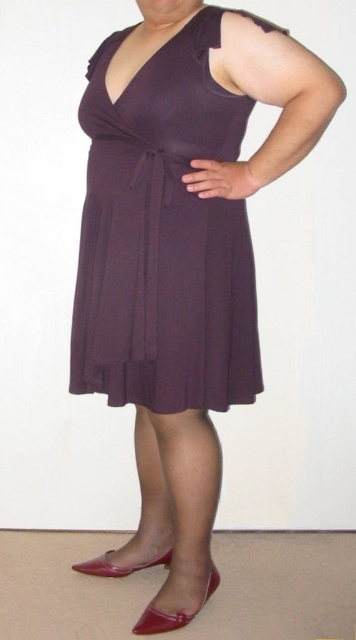
Question: Is matte purple dress at center smaller than shiny patent leather heel at lower center?

Choices:
 (A) yes
 (B) no

Answer: (B)

Question: Which point is closer to the camera?

Choices:
 (A) (89, 122)
 (B) (145, 624)

Answer: (A)

Question: Does matte purple dress at center have a smaller size compared to shiny patent leather heel at lower center?

Choices:
 (A) yes
 (B) no

Answer: (B)

Question: Which point is closer to the camera taking this photo?

Choices:
 (A) (196, 611)
 (B) (217, 275)

Answer: (B)

Question: Is the position of matte purple dress at center more distant than that of shiny patent leather heel at lower center?

Choices:
 (A) yes
 (B) no

Answer: (B)